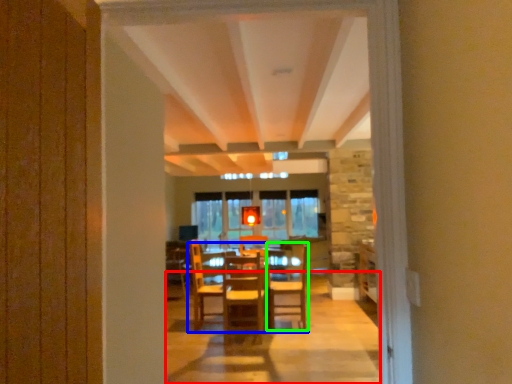
Question: Which object is the farthest from path (highlighted by a red box)? Choose among these: table (highlighted by a blue box) or chair (highlighted by a green box).

Choices:
 (A) table
 (B) chair

Answer: (A)